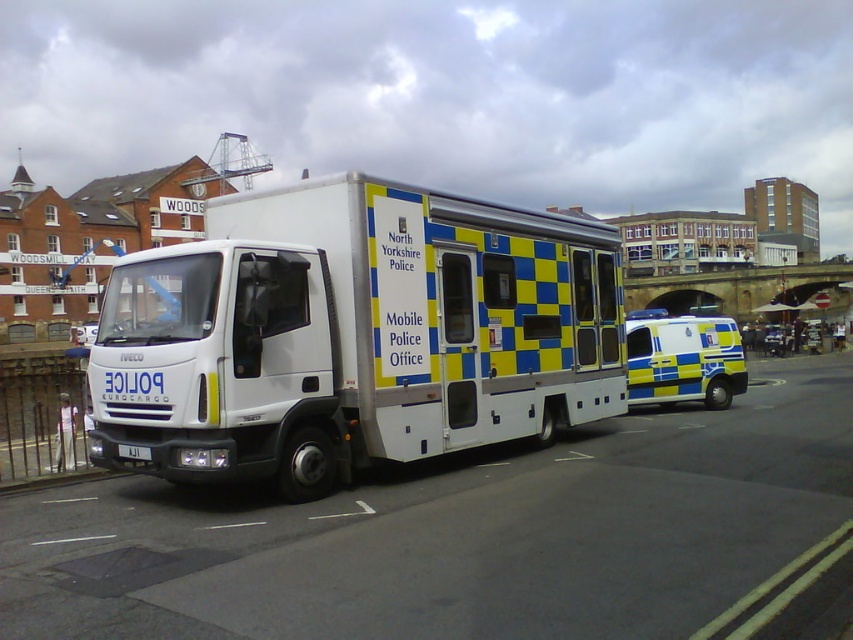
Consider the image. Is white glossy mobile police office at center below yellow and blue checkered ambulance at center?

No.

The height and width of the screenshot is (640, 853). What do you see at coordinates (352, 333) in the screenshot?
I see `white glossy mobile police office at center` at bounding box center [352, 333].

Find the location of `white glossy mobile police office at center`. white glossy mobile police office at center is located at coordinates (352, 333).

Is point (444, 346) positioned in front of point (120, 445)?

No.

Is white glossy mobile police office at center wider than white plastic license plate at center?

Yes.

Identify the location of white glossy mobile police office at center. The image size is (853, 640). (352, 333).

Is yellow and blue checkered ambulance at center positioned at the back of white plastic license plate at center?

Yes.

Does yellow and blue checkered ambulance at center have a lesser height compared to white plastic license plate at center?

In fact, yellow and blue checkered ambulance at center may be taller than white plastic license plate at center.

Is point (724, 388) positioned behind point (143, 451)?

That is True.

Where is `yellow and blue checkered ambulance at center`? The height and width of the screenshot is (640, 853). yellow and blue checkered ambulance at center is located at coordinates (683, 360).